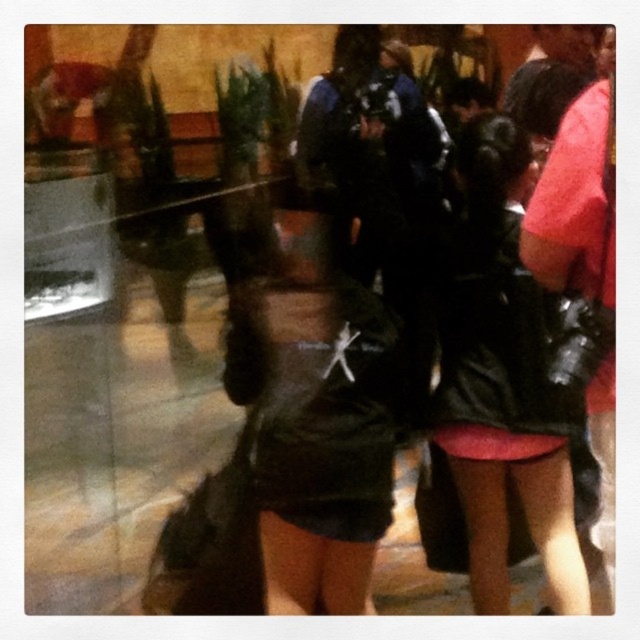
Question: Estimate the real-world distances between objects in this image. Which object is closer to the leather jacket at center?

Choices:
 (A) black leather jacket at center
 (B) black leather dress at right

Answer: (B)

Question: Estimate the real-world distances between objects in this image. Which object is farther from the black leather dress at right?

Choices:
 (A) black leather jacket at center
 (B) leather jacket at center

Answer: (A)

Question: Is black leather jacket at center thinner than leather jacket at center?

Choices:
 (A) no
 (B) yes

Answer: (A)

Question: Is leather jacket at center behind black leather dress at right?

Choices:
 (A) yes
 (B) no

Answer: (A)

Question: Is black leather jacket at center thinner than black leather dress at right?

Choices:
 (A) no
 (B) yes

Answer: (A)

Question: Which point is farther to the camera?

Choices:
 (A) (532, 499)
 (B) (269, 401)

Answer: (A)